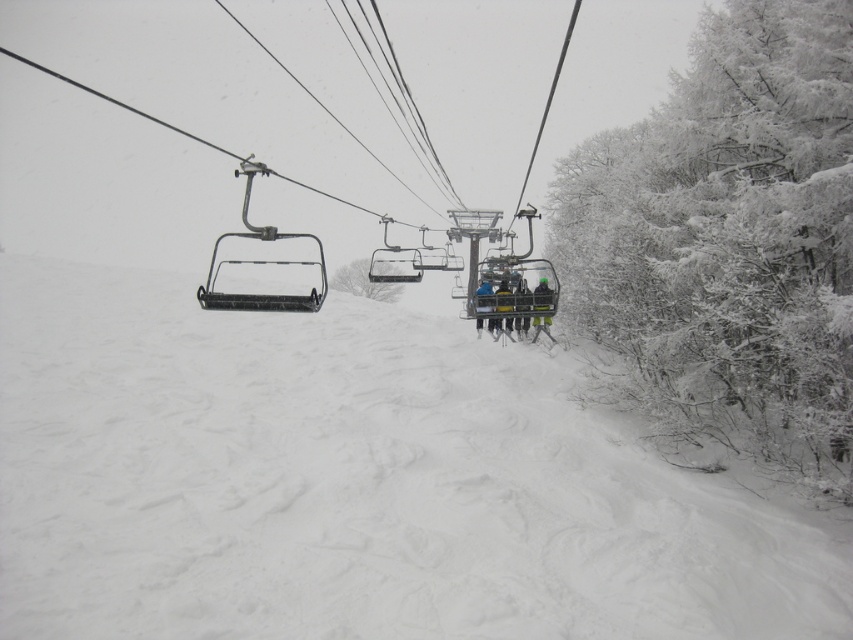
Question: Which is farther from the dark blue fabric jacket at center?

Choices:
 (A) snow-covered branches at right
 (B) white snow at center
 (C) black fabric jacket at center

Answer: (B)

Question: Can you confirm if dark blue fabric jacket at center is positioned to the right of blue fabric jacket at center?

Choices:
 (A) no
 (B) yes

Answer: (B)

Question: Which of the following is the farthest from the observer?

Choices:
 (A) snow-covered branches at right
 (B) yellow fabric jacket at center
 (C) dark blue fabric jacket at center

Answer: (B)

Question: Can you confirm if dark blue fabric jacket at center is positioned to the left of black fabric jacket at center?

Choices:
 (A) no
 (B) yes

Answer: (B)

Question: Among these points, which one is nearest to the camera?

Choices:
 (A) (751, 45)
 (B) (350, 272)
 (C) (537, 289)
 (D) (523, 291)

Answer: (A)

Question: Does dark blue fabric jacket at center have a greater width compared to yellow fabric jacket at center?

Choices:
 (A) yes
 (B) no

Answer: (A)